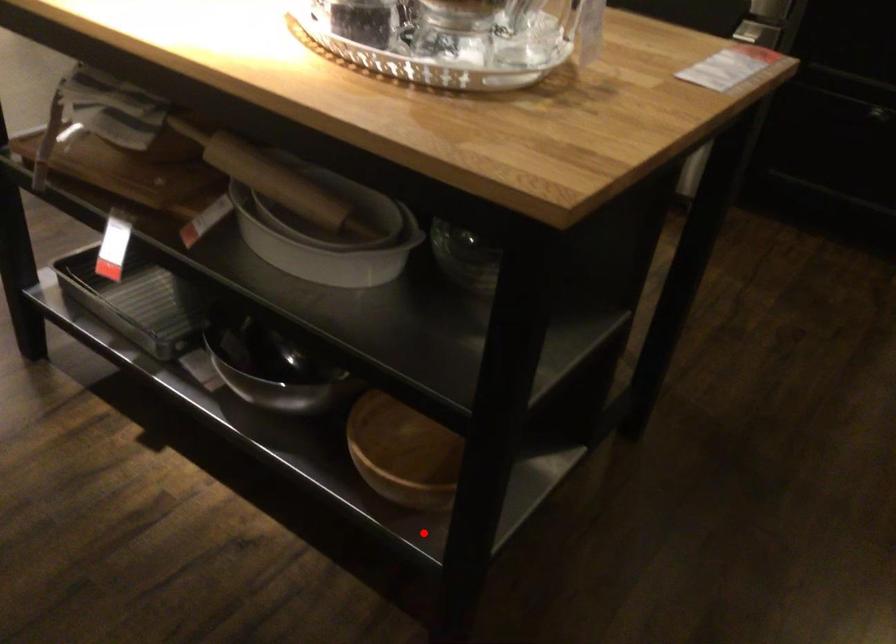
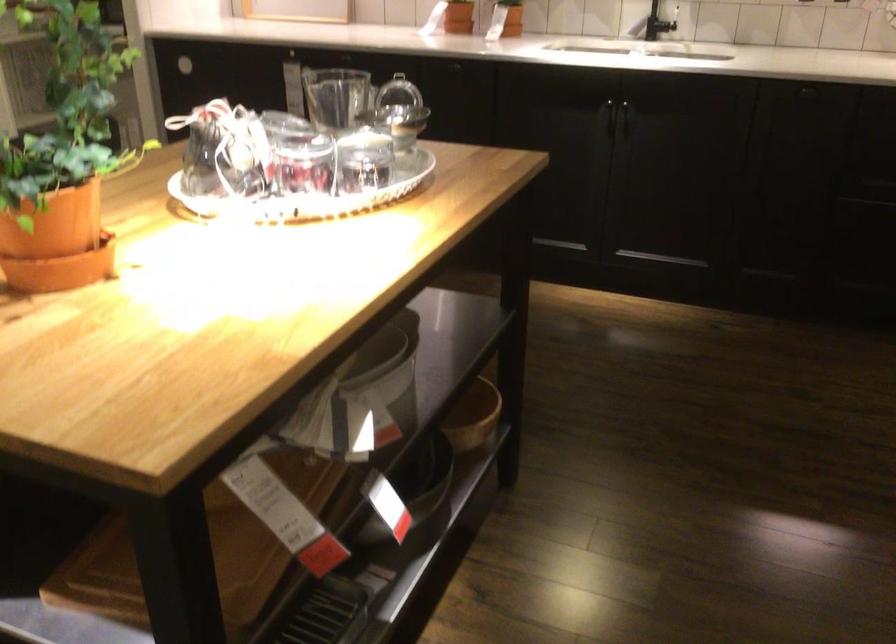
Where in the second image is the point corresponding to the highlighted location from the first image?

(472, 415)